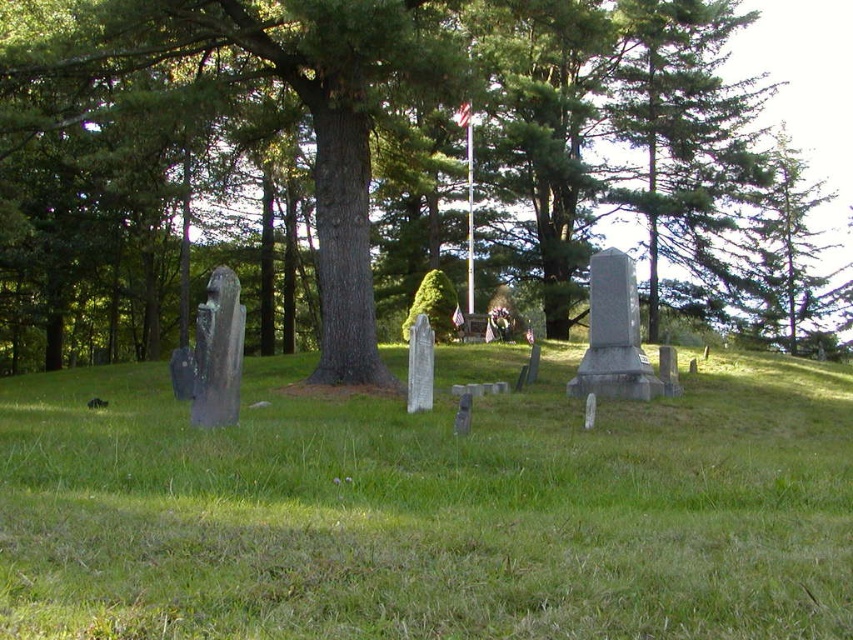
Between green grassy at center and green textured tree at center, which one is positioned lower?

Positioned lower is green grassy at center.

Which of these two, green grassy at center or green textured tree at center, stands shorter?

With less height is green grassy at center.

The width and height of the screenshot is (853, 640). I want to click on green grassy at center, so click(x=430, y=508).

Where is `green grassy at center`? This screenshot has width=853, height=640. green grassy at center is located at coordinates (430, 508).